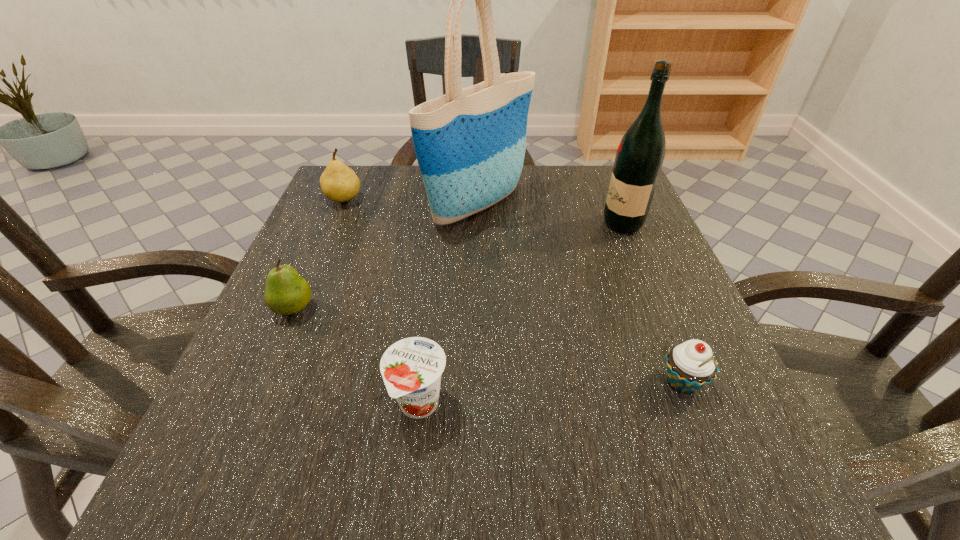
Identify the location of the closest object to the yogurt. The width and height of the screenshot is (960, 540). (286, 293).

The height and width of the screenshot is (540, 960). I want to click on free space that satisfies the following two spatial constraints: 1. on the back side of the shorter pear; 2. on the right side of the tallest object, so click(338, 206).